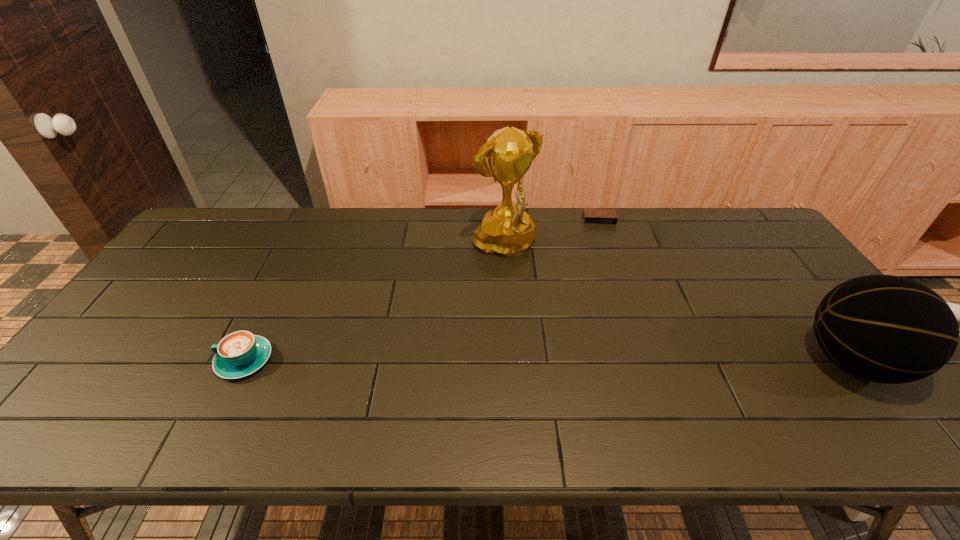
I want to click on cappuccino at the near edge, so click(241, 353).

Where is `basketball that is at the near edge`? This screenshot has height=540, width=960. basketball that is at the near edge is located at coordinates (888, 329).

Where is `object located at the right edge`? The height and width of the screenshot is (540, 960). object located at the right edge is located at coordinates pos(888,329).

Locate an element on the screen. object that is at the near right corner is located at coordinates (888, 329).

Identify the location of vacant space at the far edge of the desktop. (312, 231).

Find the location of a particular element. The height and width of the screenshot is (540, 960). free space at the near edge of the desktop is located at coordinates 444,380.

This screenshot has width=960, height=540. What are the coordinates of `vacant space at the left edge` in the screenshot? It's located at (213, 263).

I want to click on vacant space at the right edge of the desktop, so click(x=784, y=276).

I want to click on vacant space at the far left corner of the desktop, so click(250, 217).

I want to click on free space at the far right corner of the desktop, so click(736, 213).